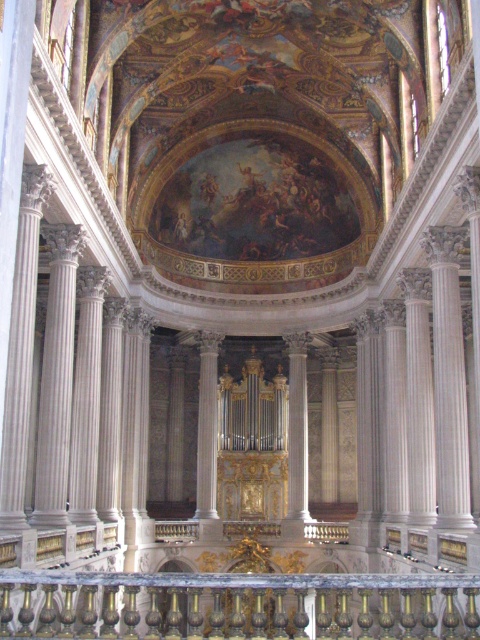
Question: Among these points, which one is farthest from the camera?

Choices:
 (A) (305, 611)
 (B) (302, 344)

Answer: (B)

Question: From the image, what is the correct spatial relationship of gold polished metal railing at center in relation to white marble pillar at center?

Choices:
 (A) right
 (B) left

Answer: (B)

Question: Is gold polished metal railing at center smaller than white marble pillar at center?

Choices:
 (A) yes
 (B) no

Answer: (B)

Question: Is gold polished metal railing at center bigger than white marble pillar at center?

Choices:
 (A) yes
 (B) no

Answer: (A)